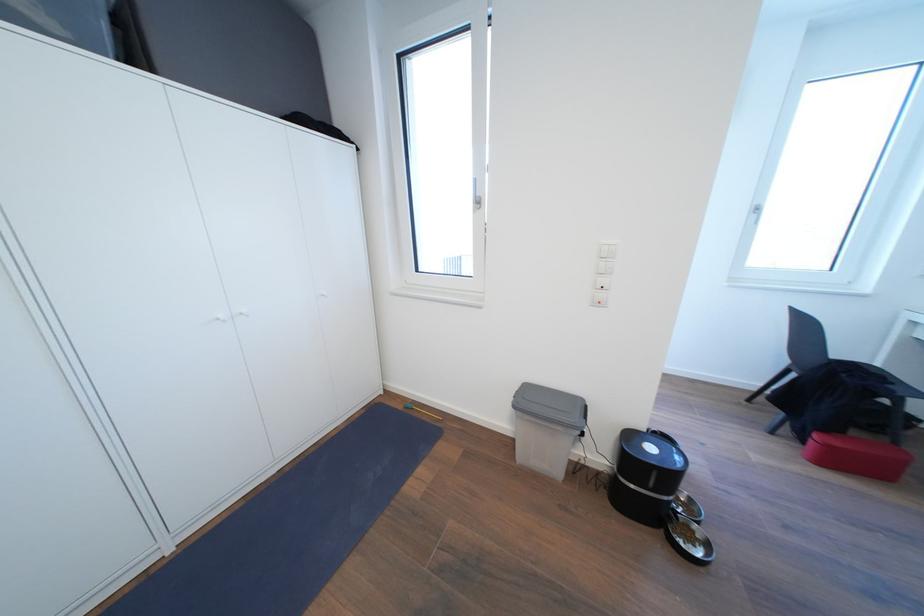
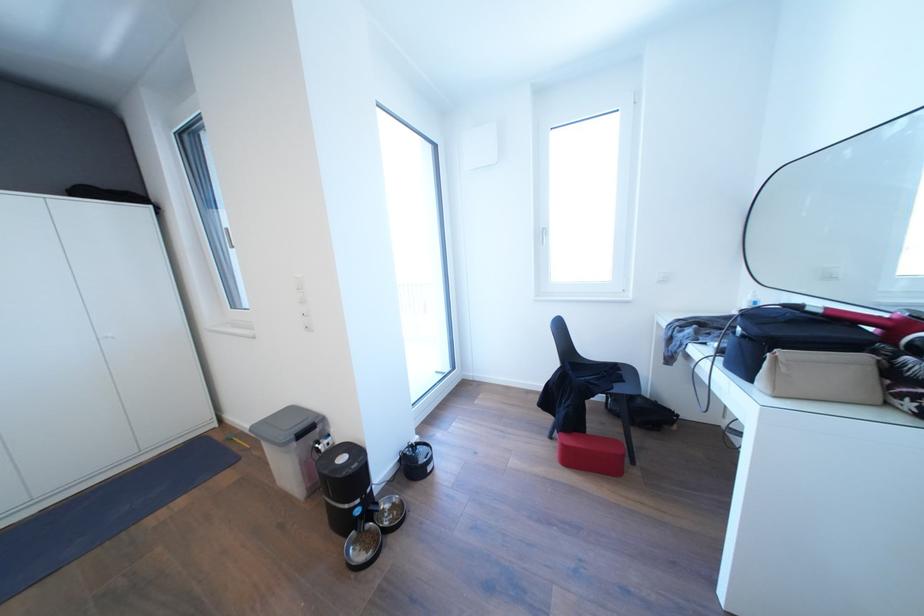
Question: Which direction would the cameraman need to move to produce the second image? Reply with the corresponding letter.

Choices:
 (A) Left
 (B) Right
 (C) Forward
 (D) Backward

Answer: (B)